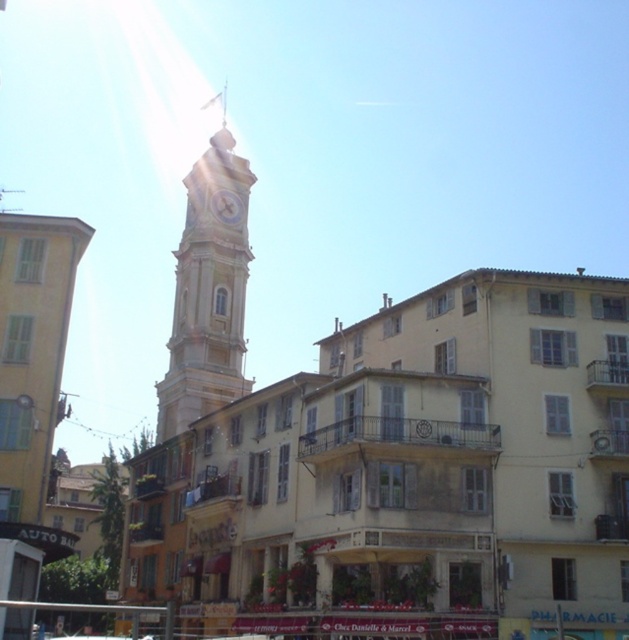
You are a tourist standing in front of the light beige stone clock tower at center and the white glossy clock at center. You want to take a photo that includes both objects. Which object should you focus on first to ensure both are in frame?

The light beige stone clock tower at center is positioned over the white glossy clock at center, so focusing on the tower first will ensure both are in frame as the clock is below it.

You are a tourist visiting the city and want to take a photo of the light beige stone clock tower at center and the white glossy clock at center. Which one should you focus on to ensure it appears bigger in your photo?

The light beige stone clock tower at center has a larger size compared to the white glossy clock at center, so you should focus on the light beige stone clock tower at center to ensure it appears bigger in your photo.

You are standing at the point with coordinates (208,292) in the urban scene. What object is located exactly at that point?

The point (208,292) corresponds to the light beige stone clock tower at center.